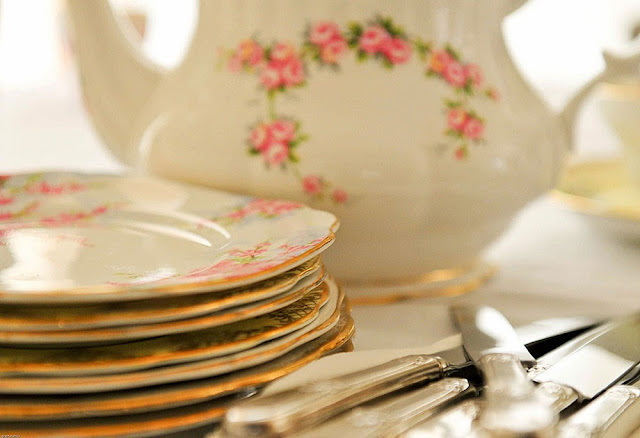
Locate an element on the screen. This screenshot has height=438, width=640. plates is located at coordinates (180, 285), (179, 311), (179, 322), (182, 353), (184, 368), (189, 392), (189, 420).